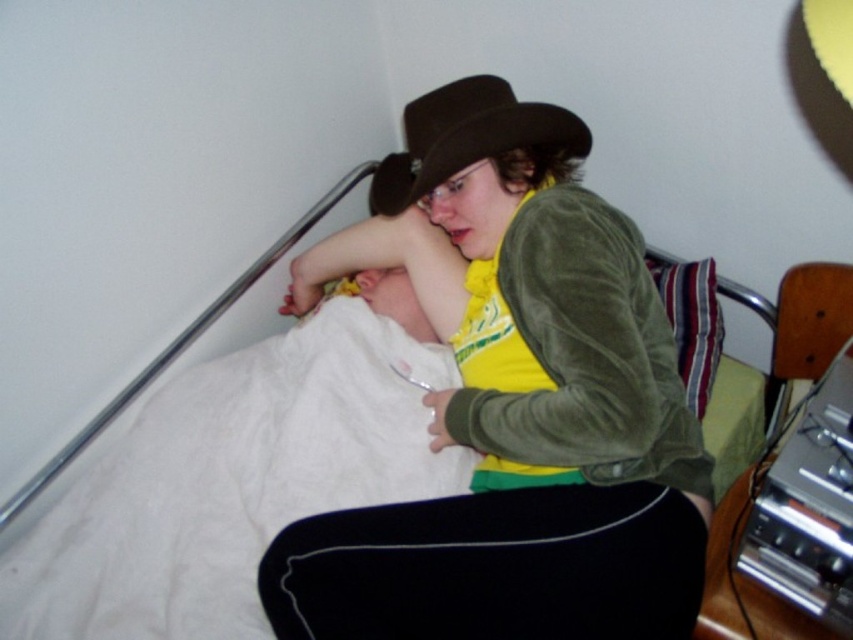
Question: Is matte brown hat at upper center to the left of brown felt fedora at upper center from the viewer's perspective?

Choices:
 (A) no
 (B) yes

Answer: (B)

Question: Does matte brown hat at upper center have a smaller size compared to black fabric at lower center?

Choices:
 (A) yes
 (B) no

Answer: (B)

Question: Which point is farther to the camera?

Choices:
 (A) (77, 568)
 (B) (647, 268)

Answer: (B)

Question: Which object appears farthest from the camera in this image?

Choices:
 (A) striped fabric pillow at upper right
 (B) brown felt fedora at upper center

Answer: (A)

Question: Which point is farther to the camera?

Choices:
 (A) striped fabric pillow at upper right
 (B) white soft blanket at upper left

Answer: (A)

Question: Is black fabric at lower center positioned at the back of brown felt fedora at upper center?

Choices:
 (A) yes
 (B) no

Answer: (B)